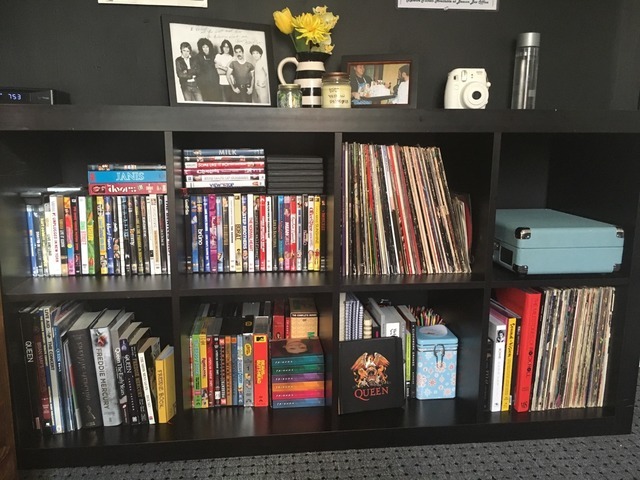
Identify the location of rug. click(x=504, y=459).